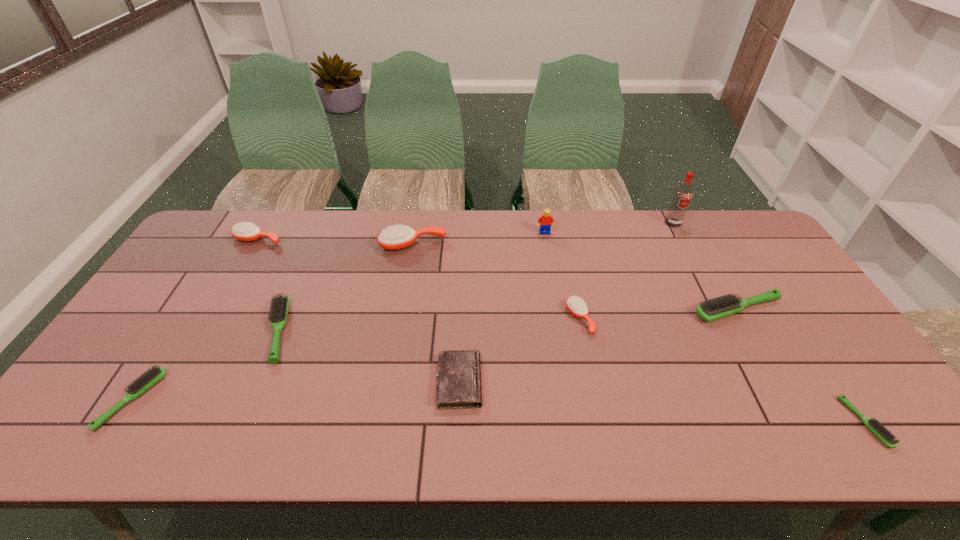
At what (x,y) coordinates should I click in order to perform the action: click on the rightmost orange hairbrush. Please return your answer as a coordinate pair (x, y). The image size is (960, 540). Looking at the image, I should click on coord(576,305).

You are a GUI agent. You are given a task and a screenshot of the screen. Output one action in this format:
    pyautogui.click(x=<x>, y=<y>)
    Task: Click on the nearest orange hairbrush
    The height and width of the screenshot is (540, 960).
    Given the screenshot: What is the action you would take?
    pyautogui.click(x=576, y=305)

I want to click on the second shortest hairbrush, so click(153, 375).

Find the location of `the third biggest light hairbrush`. the third biggest light hairbrush is located at coordinates click(153, 375).

Locate an element on the screen. The image size is (960, 540). the sixth object from right to left is located at coordinates (459, 371).

Identify the location of the smallest light hairbrush. The image size is (960, 540). (886, 437).

You are a GUI agent. You are given a task and a screenshot of the screen. Output one action in this format:
    pyautogui.click(x=<x>, y=<y>)
    Task: Click on the shortest hairbrush
    Image resolution: width=960 pixels, height=540 pixels.
    Given the screenshot: What is the action you would take?
    pyautogui.click(x=886, y=437)

Find the location of a particular element. free location located 0.250m on the front label of the farthest object is located at coordinates (702, 278).

Locate an element on the screen. The image size is (960, 540). vacant space situated on the front-facing side of the ninth shortest object is located at coordinates (558, 312).

Where is `free space located on the right of the third tallest object`? free space located on the right of the third tallest object is located at coordinates (512, 245).